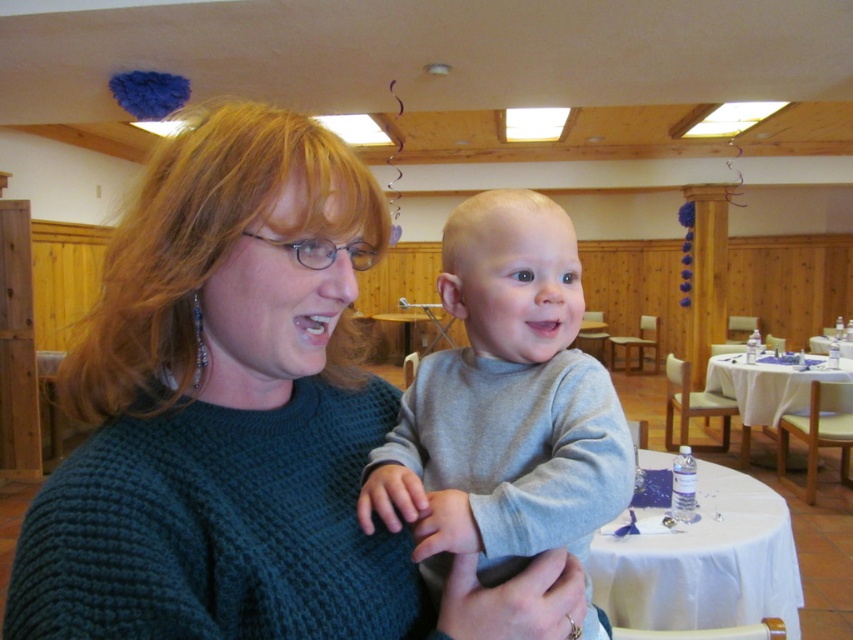
Based on the photo, you are a tailor who needs to determine which clothing item has a larger width to decide which requires more fabric. The items are the knitted dark green sweater at center and the gray cotton shirt at center. Which one has a greater width?

The knitted dark green sweater at center has a greater width than the gray cotton shirt at center according to the description.